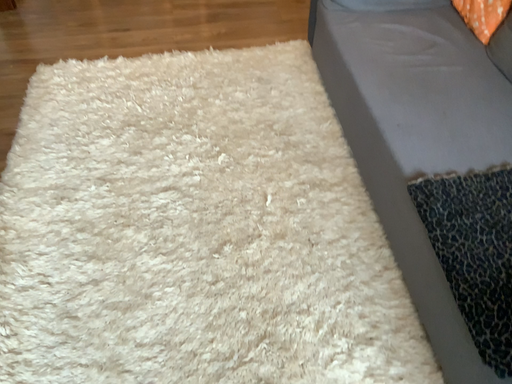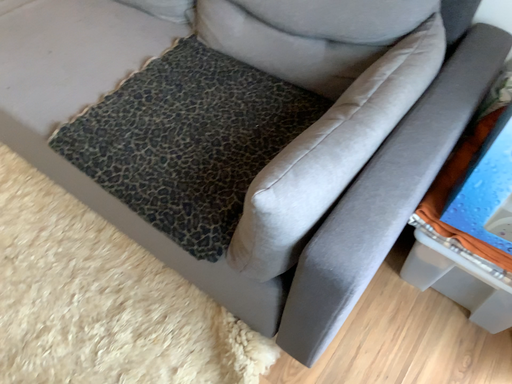
Question: Which way did the camera rotate in the video?

Choices:
 (A) rotated left
 (B) rotated right

Answer: (B)